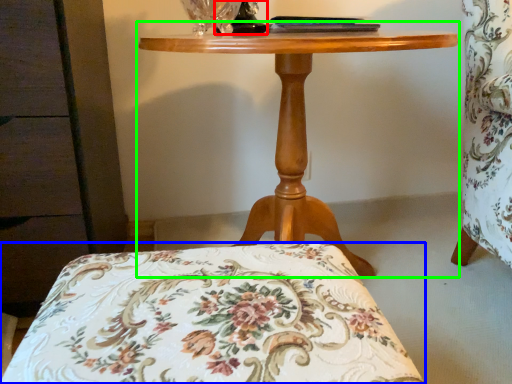
Question: Estimate the real-world distances between objects in this image. Which object is farther from table lamp (highlighted by a red box), furniture (highlighted by a blue box) or table (highlighted by a green box)?

Choices:
 (A) furniture
 (B) table

Answer: (A)